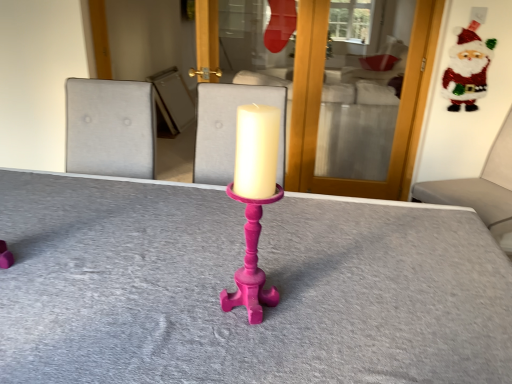
Locate an element on the screen. unoccupied space behind matte pink candle holder at center is located at coordinates (259, 259).